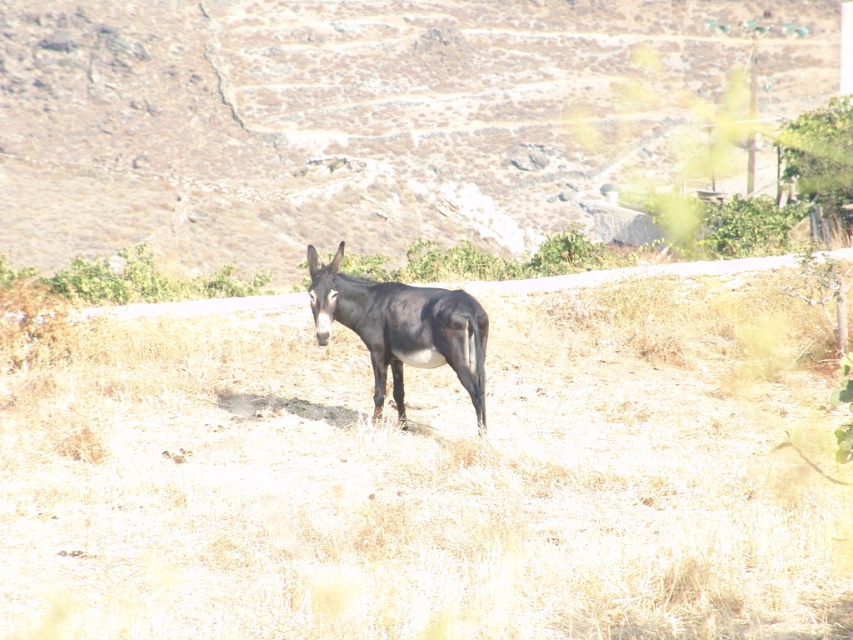
You are a photographer trying to capture the brown rough donkey at center. Given that the glare is strongest at the bottom left corner of the image, where should you avoid placing the donkey to prevent it from being overexposed?

The brown rough donkey at center is positioned at point (357, 116), which is closer to the bottom left corner with the strongest glare. To avoid overexposure, move the donkey away from that area towards the opposite side of the image.